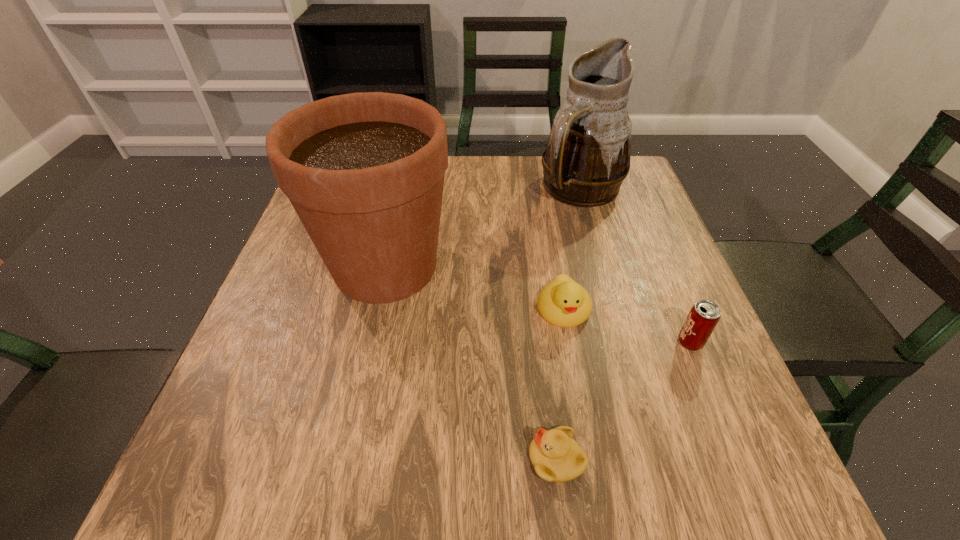
The image size is (960, 540). Identify the location of vacant area that lies between the farther duckling and the flowerpot. (474, 288).

Identify the location of vacant space that is in between the beer can and the pitcher. The width and height of the screenshot is (960, 540). click(636, 266).

Image resolution: width=960 pixels, height=540 pixels. Identify the location of free space between the leftmost object and the farthest object. (484, 228).

Where is `vacant space that is in between the taller duckling and the nearer duckling`? The width and height of the screenshot is (960, 540). vacant space that is in between the taller duckling and the nearer duckling is located at coordinates (560, 384).

Locate an element on the screen. The width and height of the screenshot is (960, 540). vacant region between the taller duckling and the beer can is located at coordinates (627, 326).

Where is `free space between the flowerpot and the beer can`? free space between the flowerpot and the beer can is located at coordinates (538, 305).

Locate an element on the screen. The image size is (960, 540). the closest object to the farther duckling is located at coordinates (704, 315).

Image resolution: width=960 pixels, height=540 pixels. In order to click on object that can be found as the closest to the pitcher in this screenshot , I will do `click(364, 172)`.

Image resolution: width=960 pixels, height=540 pixels. Identify the location of free space that satisfies the following two spatial constraints: 1. from the spout of the farthest object; 2. on the right side of the beer can. (625, 342).

The height and width of the screenshot is (540, 960). In order to click on free location that satisfies the following two spatial constraints: 1. from the spout of the pitcher; 2. on the front-facing side of the shorter duckling in this screenshot , I will do `click(659, 459)`.